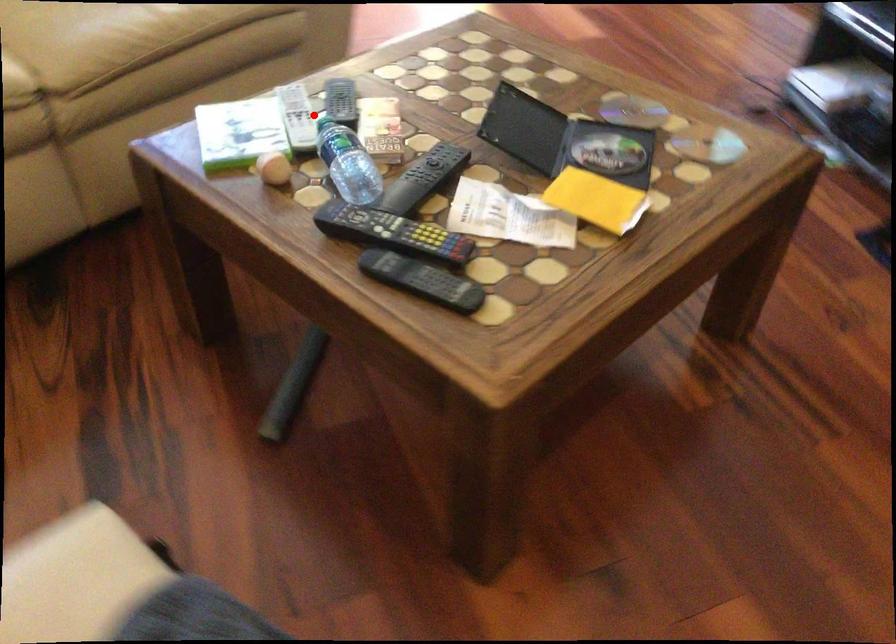
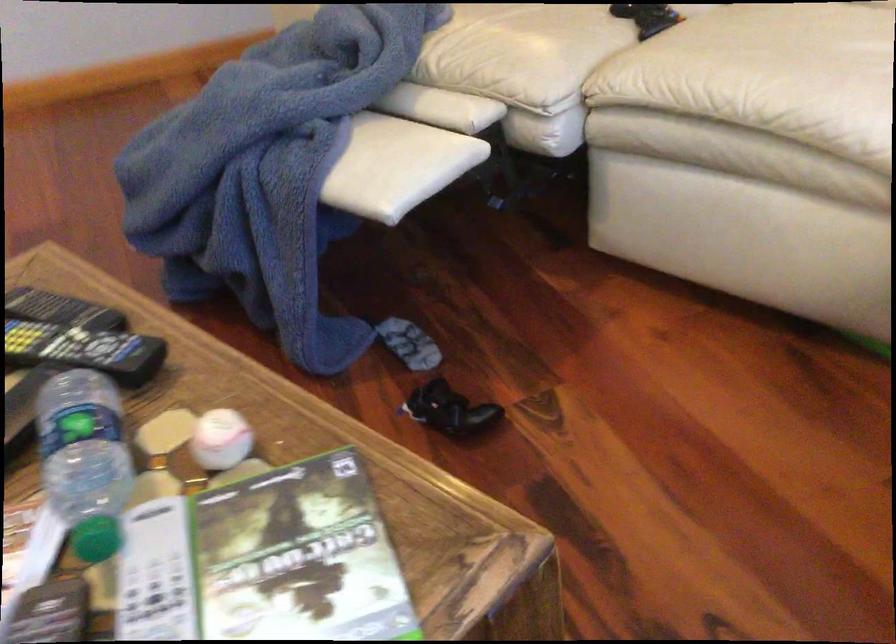
Find the pixel in the second image that matches the highlighted location in the first image.

(156, 574)